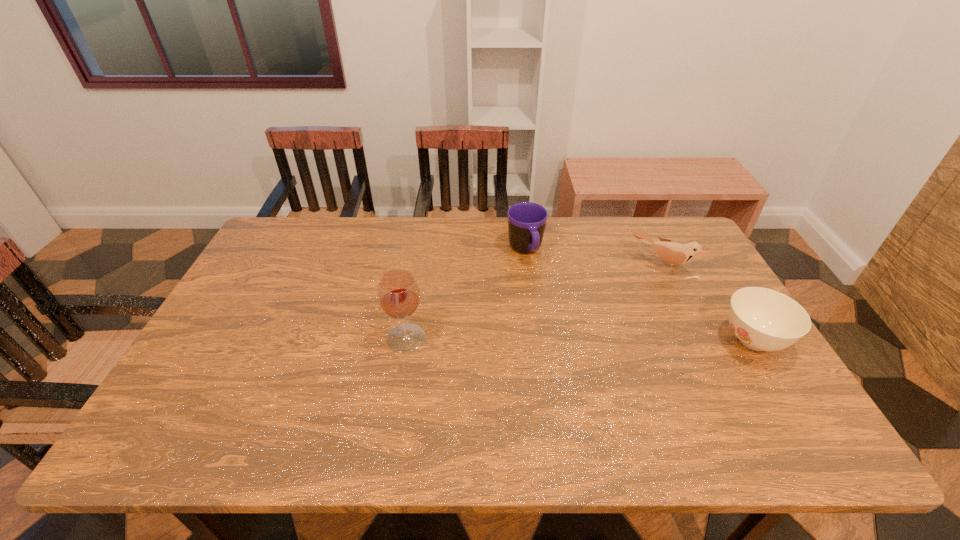
The image size is (960, 540). Identify the location of the leftmost object. (398, 293).

At what (x,y) coordinates should I click in order to perform the action: click on wineglass. Please return your answer as a coordinate pair (x, y). This screenshot has height=540, width=960. Looking at the image, I should click on [398, 293].

Where is `sugar bowl`? This screenshot has height=540, width=960. sugar bowl is located at coordinates (762, 319).

Where is `bird`? bird is located at coordinates (673, 253).

What are the coordinates of `the second object from left to right` in the screenshot? It's located at (527, 222).

Where is `free spot located 0.150m on the front of the leftmost object`? The width and height of the screenshot is (960, 540). free spot located 0.150m on the front of the leftmost object is located at coordinates (395, 404).

Locate an element on the screen. The width and height of the screenshot is (960, 540). vacant space located on the left of the sugar bowl is located at coordinates (625, 341).

The image size is (960, 540). In order to click on vacant space located 0.250m at the beak of the bird in this screenshot , I will do `click(616, 326)`.

I want to click on vacant space situated at the beak of the bird, so click(x=643, y=287).

Image resolution: width=960 pixels, height=540 pixels. Find the location of `free spot located at the beak of the bird`. free spot located at the beak of the bird is located at coordinates (629, 307).